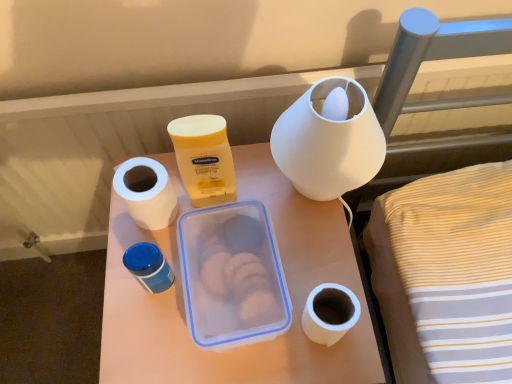
Locate an element on the screen. The image size is (512, 384). free point above white plastic container at center (from a real-world perspective) is located at coordinates (224, 264).